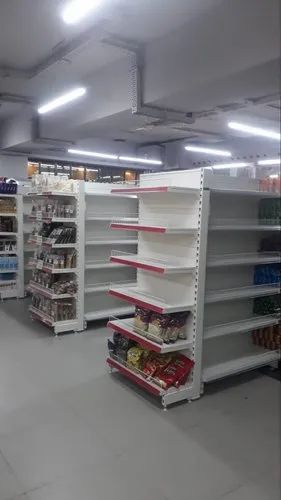
You are a GUI agent. You are given a task and a screenshot of the screen. Output one action in this format:
    pyautogui.click(x=<x>, y=<y>)
    Task: Click on the windows
    The width and height of the screenshot is (281, 500).
    Given the screenshot: What is the action you would take?
    pyautogui.click(x=77, y=173)